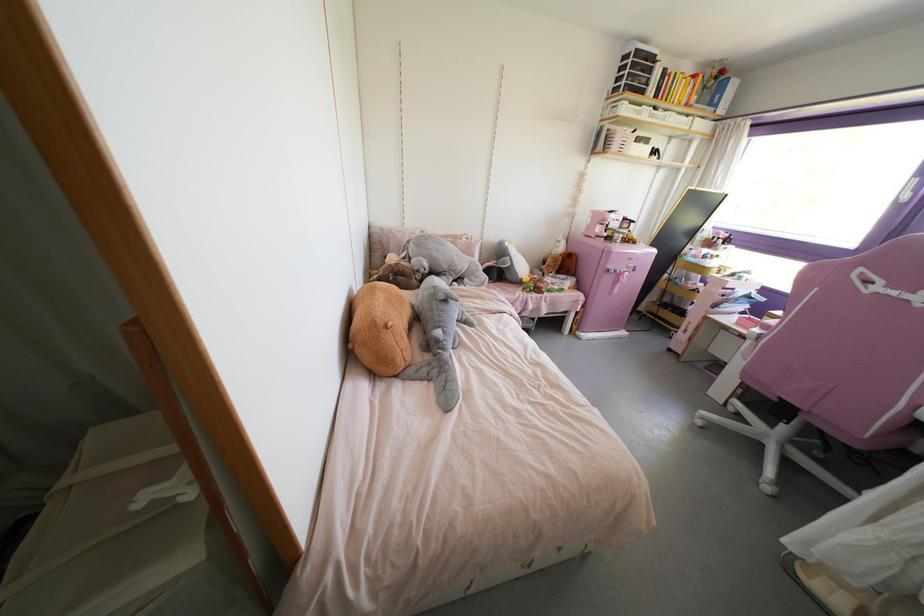
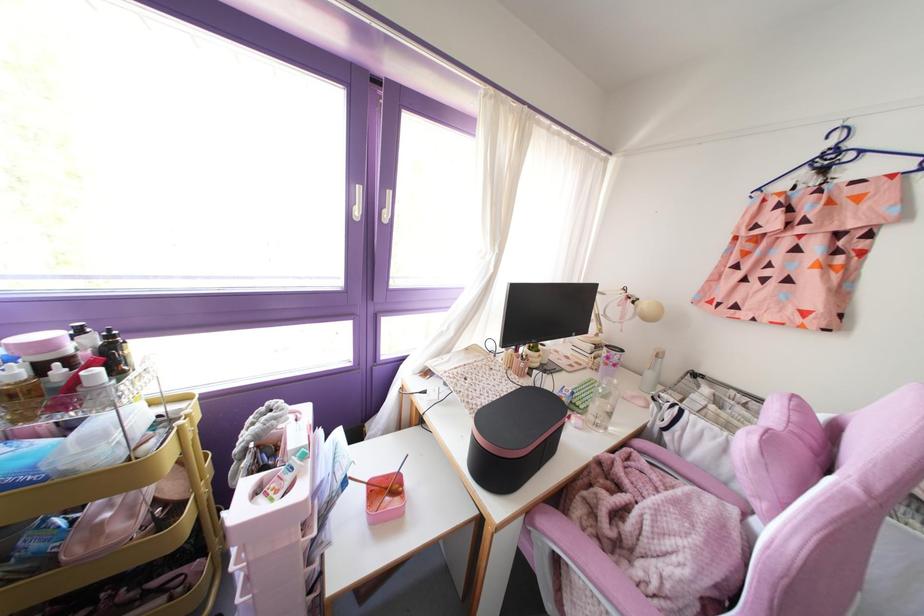
In the second image, find the point that corresponds to point 723,243 in the first image.

(116, 373)